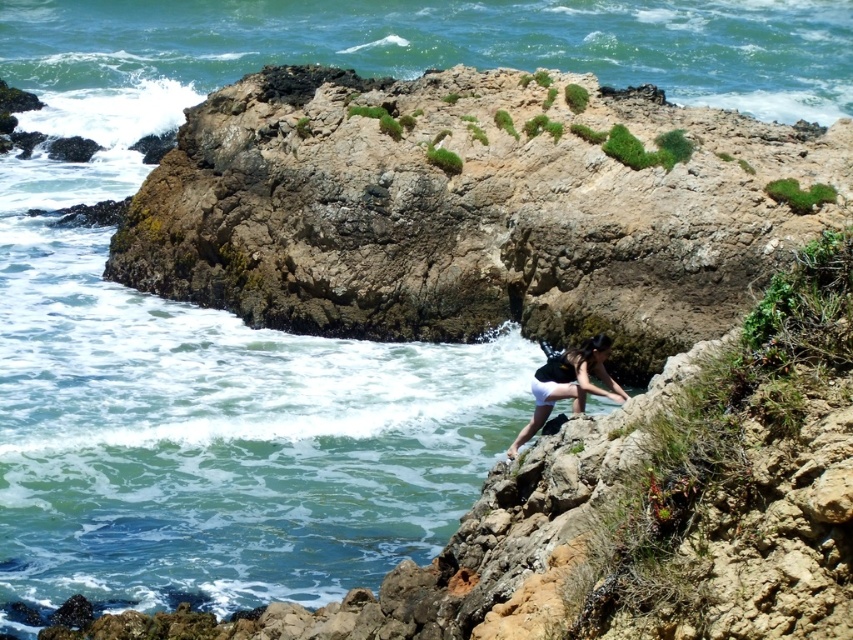
You are standing at the base of the rocky slope and see two points marked on the rock face. The first point is at coordinates point [581,390] and the second point is at point [544,392]. Which point is closer to you?

Point [581,390] is closer to the viewer than point [544,392].

You are a hiker trying to climb the rocky slope. You notice the white matte shorts at lower center and the white matte bikini top at lower center. How much space is there between them?

There is a distance of 13.27 inches between the white matte shorts at lower center and the white matte bikini top at lower center.